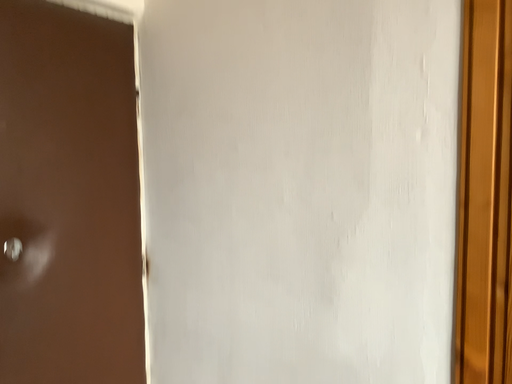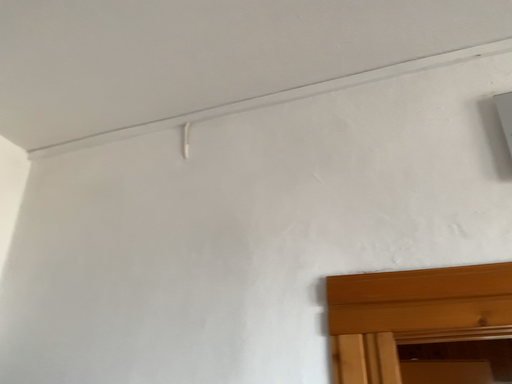
Question: Which way did the camera rotate in the video?

Choices:
 (A) rotated upward
 (B) rotated downward

Answer: (A)